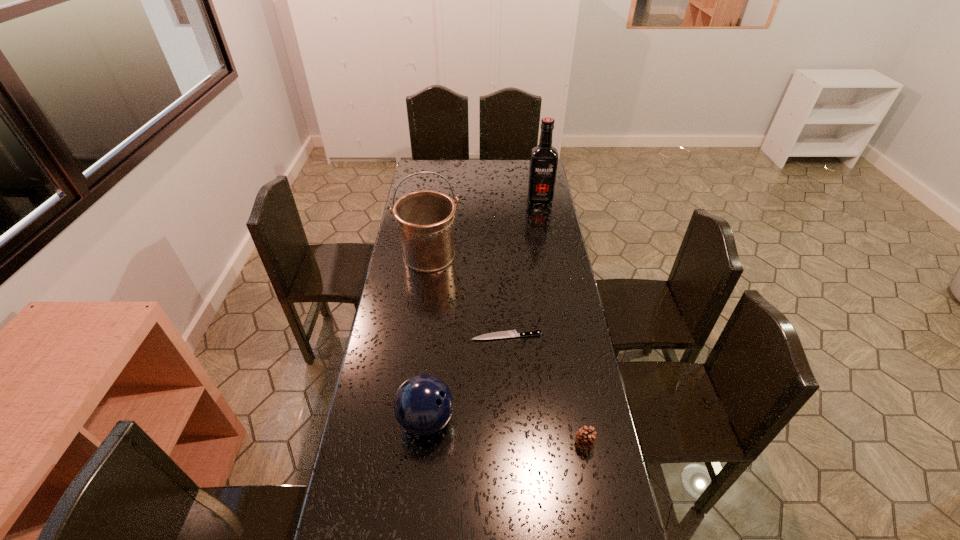
Find the location of a particular element. The width and height of the screenshot is (960, 540). free space that is in between the pinecone and the liquor is located at coordinates (562, 321).

The image size is (960, 540). In order to click on vacant area between the third nearest object and the fourth tallest object in this screenshot , I will do `click(545, 389)`.

The height and width of the screenshot is (540, 960). Identify the location of unoccupied position between the liquor and the third object from left to right. (523, 267).

Find the location of `empty space between the liquor and the steak knife`. empty space between the liquor and the steak knife is located at coordinates (523, 267).

This screenshot has height=540, width=960. Find the location of `free spot between the second farthest object and the liquor`. free spot between the second farthest object and the liquor is located at coordinates (485, 227).

You are a GUI agent. You are given a task and a screenshot of the screen. Output one action in this format:
    pyautogui.click(x=<x>, y=<y>)
    Task: Click on the free area in between the farthest object and the third tallest object
    This screenshot has height=540, width=960.
    Given the screenshot: What is the action you would take?
    pyautogui.click(x=483, y=309)

At what (x,y) coordinates should I click in order to perform the action: click on empty location between the steak knife and the fourth nearest object. Please return your answer as a coordinate pair (x, y). Looking at the image, I should click on (468, 296).

The width and height of the screenshot is (960, 540). I want to click on vacant region between the pinecone and the second farthest object, so [507, 349].

Locate an element on the screen. The height and width of the screenshot is (540, 960). free space between the second farthest object and the farthest object is located at coordinates (485, 227).

Identify which object is the second nearest to the third shortest object. Please provide its 2D coordinates. Your answer should be formatted as a tuple, i.e. [(x, y)], where the tuple contains the x and y coordinates of a point satisfying the conditions above.

[(585, 438)]